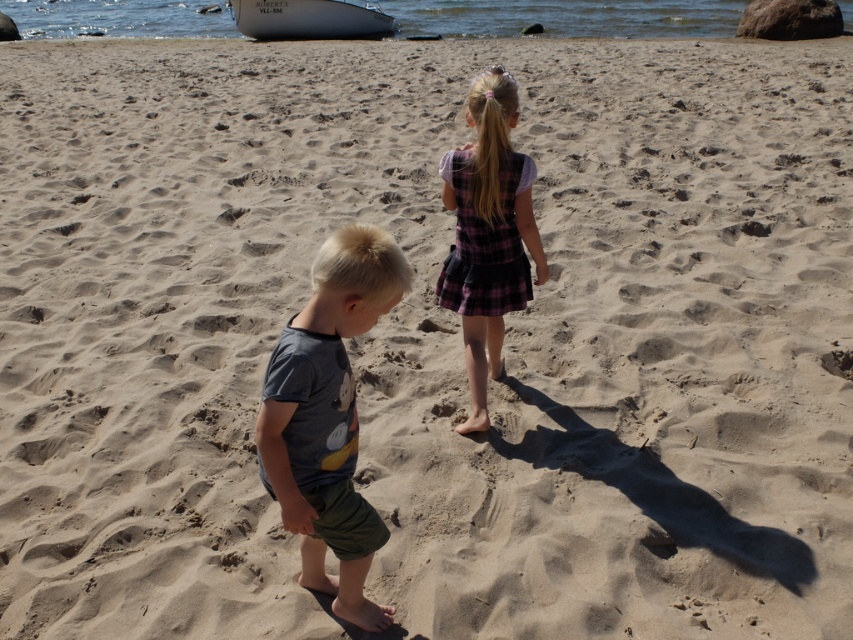
Measure the distance between dark gray cotton shirt at center and camera.

dark gray cotton shirt at center and camera are 7.64 feet apart.

Between point (366, 564) and point (521, 163), which one is positioned in front?

Positioned in front is point (366, 564).

Is point (314, 330) behind point (486, 202)?

No, (314, 330) is in front of (486, 202).

Locate an element on the screen. The image size is (853, 640). dark gray cotton shirt at center is located at coordinates (328, 417).

Consider the image. Who is positioned more to the right, plaid fabric dress at center or white glossy boat at upper center?

From the viewer's perspective, plaid fabric dress at center appears more on the right side.

What do you see at coordinates (488, 234) in the screenshot? I see `plaid fabric dress at center` at bounding box center [488, 234].

In order to click on plaid fabric dress at center in this screenshot , I will do `click(488, 234)`.

Is dark gray cotton shirt at center shorter than white glossy boat at upper center?

Yes, dark gray cotton shirt at center is shorter than white glossy boat at upper center.

Does dark gray cotton shirt at center lie in front of white glossy boat at upper center?

Yes, it is.

Between point (374, 618) and point (251, 12), which one is positioned behind?

The point (251, 12) is behind.

Locate an element on the screen. dark gray cotton shirt at center is located at coordinates (328, 417).